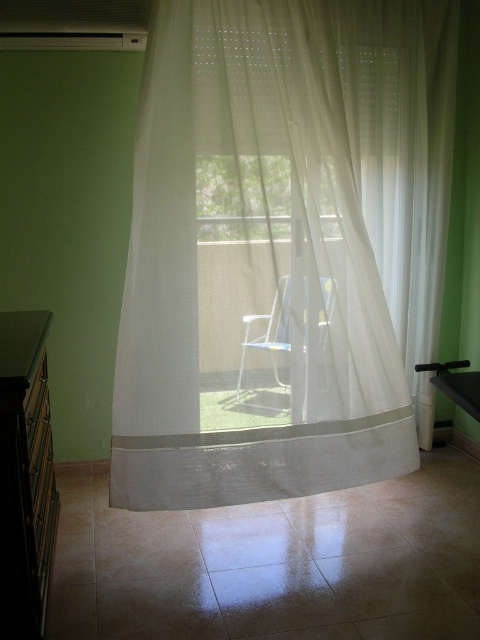
You are standing in the room and want to move from the matte black dresser at left to the white sheer curtain at center. Which direction should you move to get closer to the curtain?

You should move forward towards the white sheer curtain at center because it is closer to you than the matte black dresser at left.

You are standing in the room and want to move from the matte black dresser at left to the white sheer curtain at center. Which direction should you walk towards?

You should walk towards the right side of the room since the white sheer curtain at center is to the right of the matte black dresser at left.